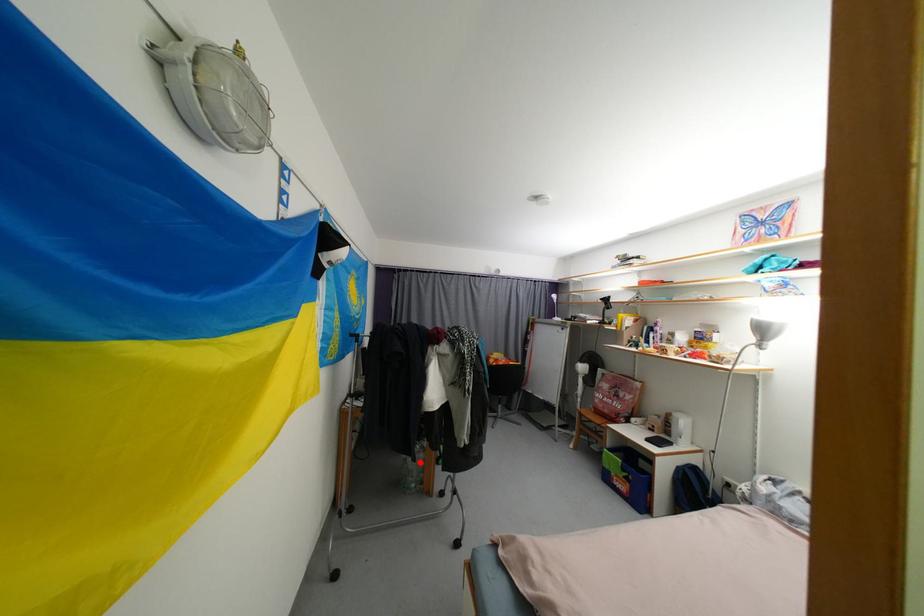
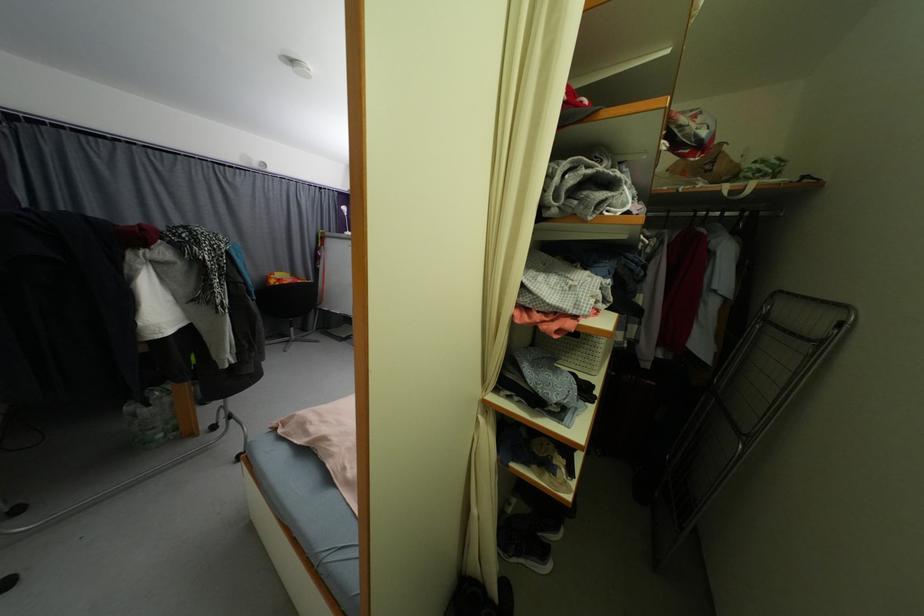
Question: I am providing you with two images of the same scene from different viewpoints. Image1 has a red point marked. In image2, the corresponding 3D location appears at what relative position? Reply with the corresponding letter.

Choices:
 (A) Closer
 (B) Farther

Answer: (A)